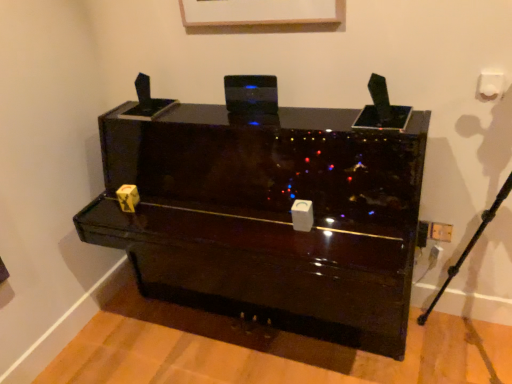
Locate an element on the screen. Image resolution: width=512 pixels, height=384 pixels. glossy dark wood piano at center is located at coordinates (268, 218).

What do you see at coordinates (268, 218) in the screenshot? I see `glossy dark wood piano at center` at bounding box center [268, 218].

You are a GUI agent. You are given a task and a screenshot of the screen. Output one action in this format:
    pyautogui.click(x=<x>, y=<y>)
    Task: Click on the glossy dark wood piano at center
    
    Given the screenshot: What is the action you would take?
    pyautogui.click(x=268, y=218)